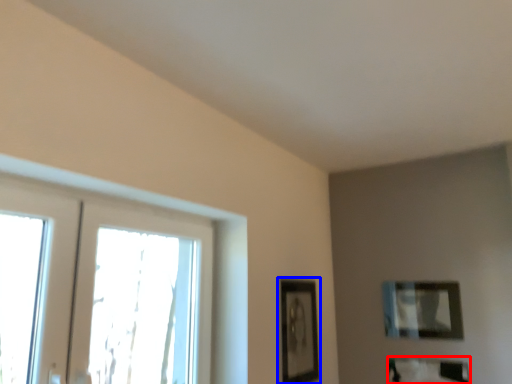
Question: Which point is further to the camera, picture frame (highlighted by a red box) or picture frame (highlighted by a blue box)?

Choices:
 (A) picture frame
 (B) picture frame

Answer: (A)